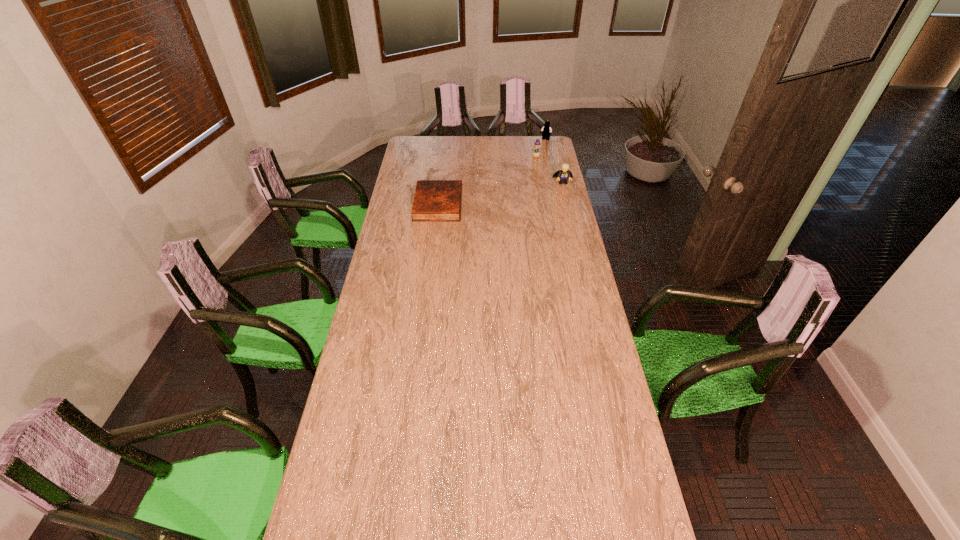
This screenshot has height=540, width=960. What are the coordinates of `vacant space on the desktop that is between the nearest object and the nearer Lego and is positioned on the face of the duckling, where the monocle is placed` in the screenshot? It's located at (508, 192).

This screenshot has width=960, height=540. I want to click on vacant space on the desktop that is between the Bible and the third farthest object and is positioned on the front-facing side of the farther Lego, so click(519, 190).